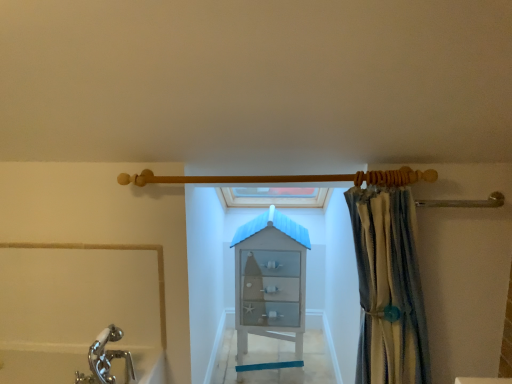
Question: From a real-world perspective, is striped fabric curtain at right on white glass cabinet at center?

Choices:
 (A) no
 (B) yes

Answer: (B)

Question: Is striped fabric curtain at right oriented away from white glass cabinet at center?

Choices:
 (A) no
 (B) yes

Answer: (A)

Question: From a real-world perspective, is striped fabric curtain at right located beneath white glass cabinet at center?

Choices:
 (A) yes
 (B) no

Answer: (B)

Question: Is striped fabric curtain at right far away from white glass cabinet at center?

Choices:
 (A) no
 (B) yes

Answer: (A)

Question: Considering the relative sizes of striped fabric curtain at right and white glass cabinet at center in the image provided, is striped fabric curtain at right smaller than white glass cabinet at center?

Choices:
 (A) yes
 (B) no

Answer: (A)

Question: Considering the positions of wooden shower rod at upper center and striped fabric curtain at right in the image, is wooden shower rod at upper center bigger or smaller than striped fabric curtain at right?

Choices:
 (A) big
 (B) small

Answer: (B)

Question: From a real-world perspective, is wooden shower rod at upper center above or below striped fabric curtain at right?

Choices:
 (A) above
 (B) below

Answer: (A)

Question: In terms of height, does wooden shower rod at upper center look taller or shorter compared to striped fabric curtain at right?

Choices:
 (A) tall
 (B) short

Answer: (B)

Question: Based on their positions, is wooden shower rod at upper center located to the left or right of striped fabric curtain at right?

Choices:
 (A) right
 (B) left

Answer: (B)

Question: In the image, is striped fabric curtain at right positioned in front of or behind white glass cabinet at center?

Choices:
 (A) behind
 (B) front

Answer: (B)

Question: From the image's perspective, is striped fabric curtain at right positioned above or below white glass cabinet at center?

Choices:
 (A) below
 (B) above

Answer: (B)

Question: Looking at the image, does striped fabric curtain at right seem bigger or smaller compared to white glass cabinet at center?

Choices:
 (A) big
 (B) small

Answer: (B)

Question: Is striped fabric curtain at right inside or outside of white glass cabinet at center?

Choices:
 (A) outside
 (B) inside

Answer: (A)

Question: Is white glass cabinet at center taller or shorter than wooden shower rod at upper center?

Choices:
 (A) tall
 (B) short

Answer: (A)

Question: Is white glass cabinet at center in front of or behind wooden shower rod at upper center in the image?

Choices:
 (A) behind
 (B) front

Answer: (A)